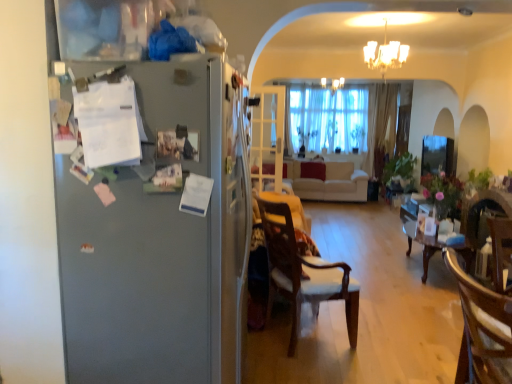
Question: In the image, is satin silver refrigerator at left on the left side or the right side of white glass chandelier at upper center, placed as the 2th light fixture when sorted from bottom to top?

Choices:
 (A) left
 (B) right

Answer: (A)

Question: Is point (203, 238) positioned closer to the camera than point (333, 87)?

Choices:
 (A) farther
 (B) closer

Answer: (B)

Question: Estimate the real-world distances between objects in this image. Which object is closer to the wooden chair at lower right, which ranks as the second chair in back-to-front order?

Choices:
 (A) white glass door at center
 (B) beige fabric couch at center
 (C) white glass chandelier at upper center, the second light fixture viewed from the front
 (D) wooden chair at center, the second chair when ordered from right to left
 (E) transparent glass window screen at center

Answer: (D)

Question: Estimate the real-world distances between objects in this image. Which object is farther from the white glass chandelier at upper center, which appears as the first light fixture when viewed from the back?

Choices:
 (A) wooden chair at center, the first chair in the left-to-right sequence
 (B) beige fabric couch at center
 (C) white glass door at center
 (D) white glass chandelier at upper center, the second light fixture positioned from the top
 (E) transparent glass window screen at center

Answer: (A)